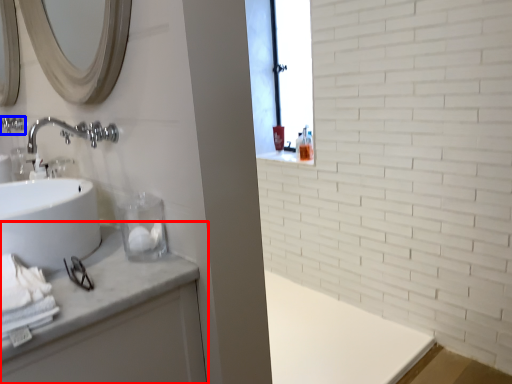
Question: Which object is closer to the camera taking this photo, bathroom cabinet (highlighted by a red box) or plumbing fixture (highlighted by a blue box)?

Choices:
 (A) bathroom cabinet
 (B) plumbing fixture

Answer: (A)